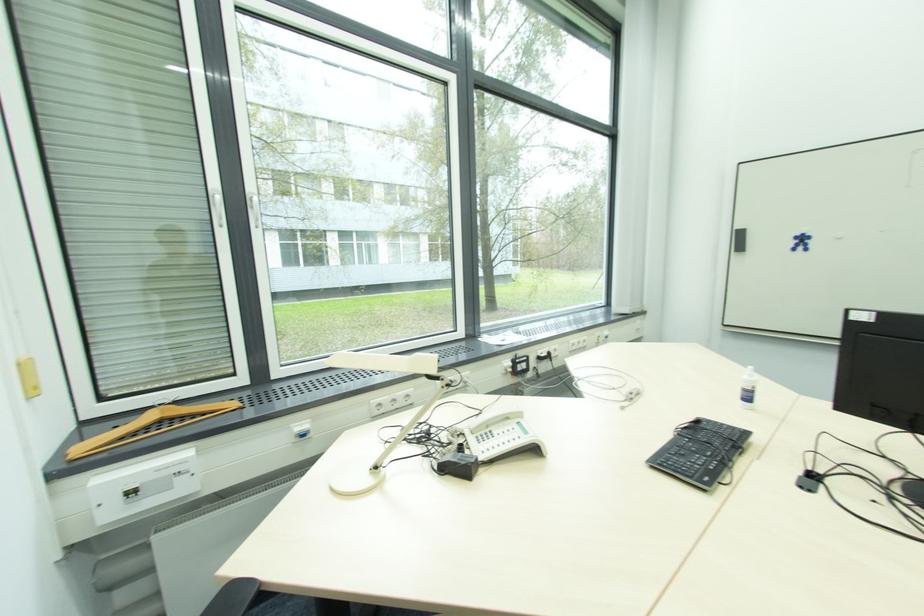
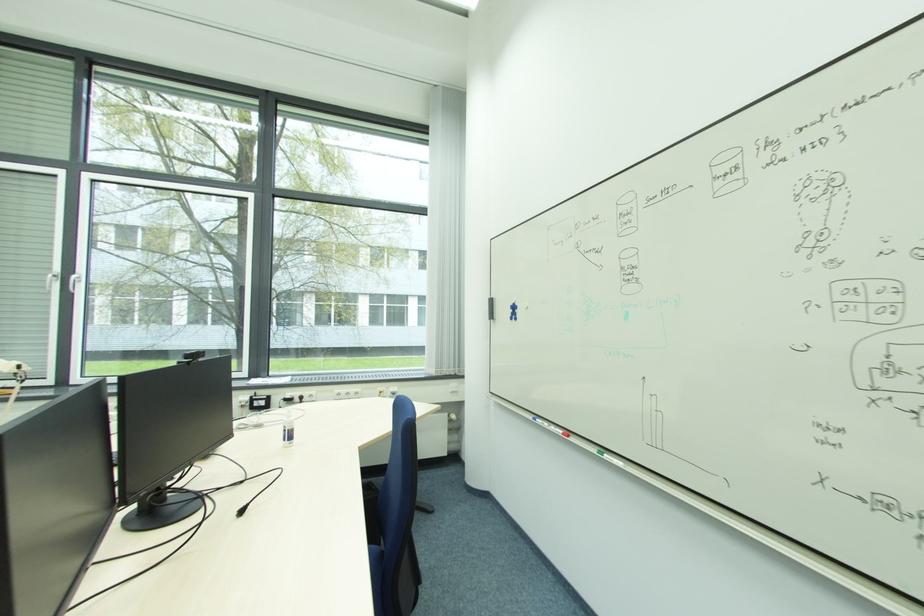
Find the pixel in the second image that matches pixel 801 244 in the first image.

(515, 313)